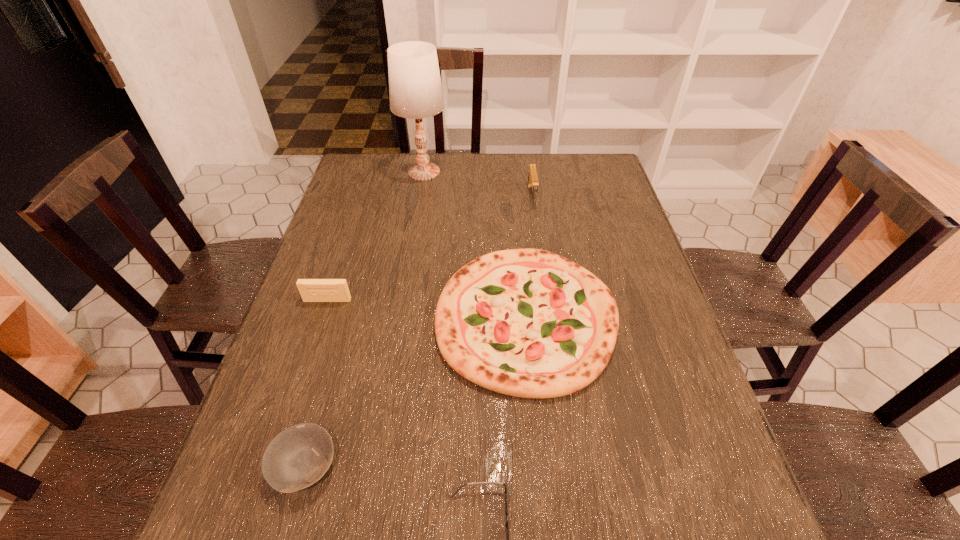
You are a GUI agent. You are given a task and a screenshot of the screen. Output one action in this format:
    pyautogui.click(x=<x>, y=<y>)
    Task: Click on the lamp positioned at the far edge
    
    Given the screenshot: What is the action you would take?
    [415, 89]

The width and height of the screenshot is (960, 540). In order to click on pistol that is positioned at the far edge in this screenshot , I will do `click(532, 183)`.

Find the location of a particular element. The height and width of the screenshot is (540, 960). videotape that is at the left edge is located at coordinates (311, 290).

Image resolution: width=960 pixels, height=540 pixels. I want to click on bowl present at the left edge, so tap(299, 456).

Image resolution: width=960 pixels, height=540 pixels. In order to click on object situated at the right edge in this screenshot , I will do `click(529, 323)`.

In the image, there is a desktop. Where is `vacant region at the far edge`? This screenshot has width=960, height=540. vacant region at the far edge is located at coordinates (484, 190).

Locate an element on the screen. Image resolution: width=960 pixels, height=540 pixels. vacant space at the left edge is located at coordinates pyautogui.click(x=310, y=318).

In the image, there is a desktop. Where is `vacant space at the right edge`? The image size is (960, 540). vacant space at the right edge is located at coordinates (636, 233).

Where is `free space at the far right corner of the desktop`? The width and height of the screenshot is (960, 540). free space at the far right corner of the desktop is located at coordinates (572, 174).

Identify the location of free spot between the pizza and the bowl. (416, 392).